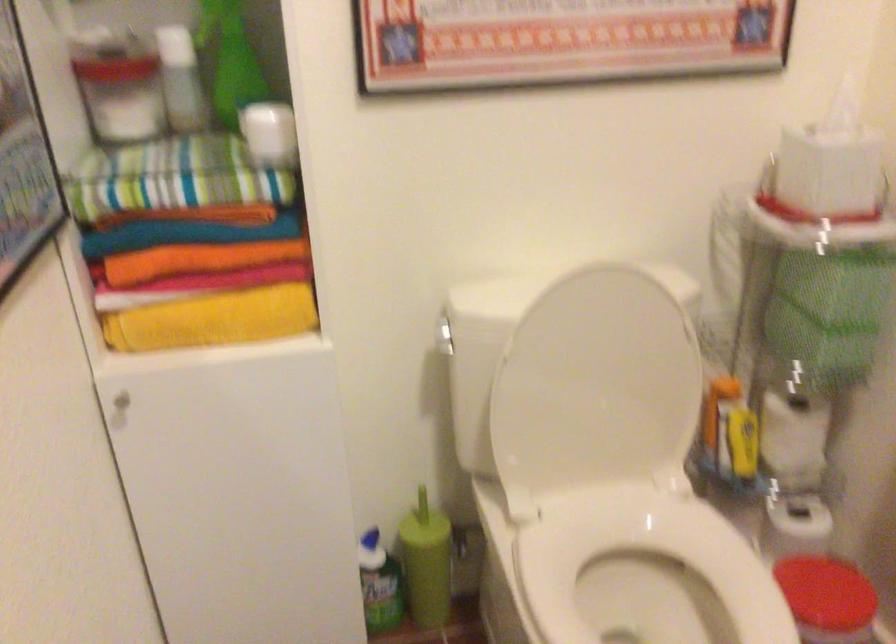
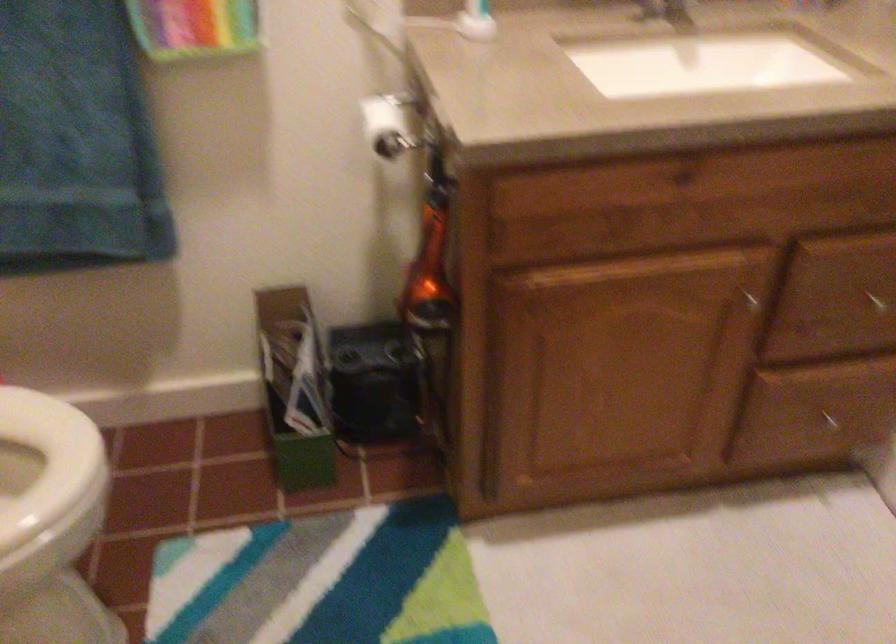
The first image is from the beginning of the video and the second image is from the end. How did the camera likely rotate when shooting the video?

The camera's rotation is toward right-down.